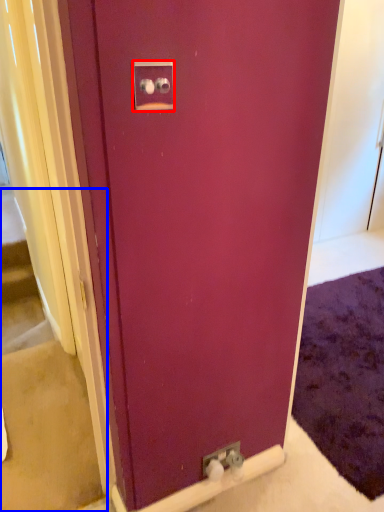
Question: Among these objects, which one is farthest to the camera, electric outlet (highlighted by a red box) or stairwell (highlighted by a blue box)?

Choices:
 (A) electric outlet
 (B) stairwell

Answer: (B)